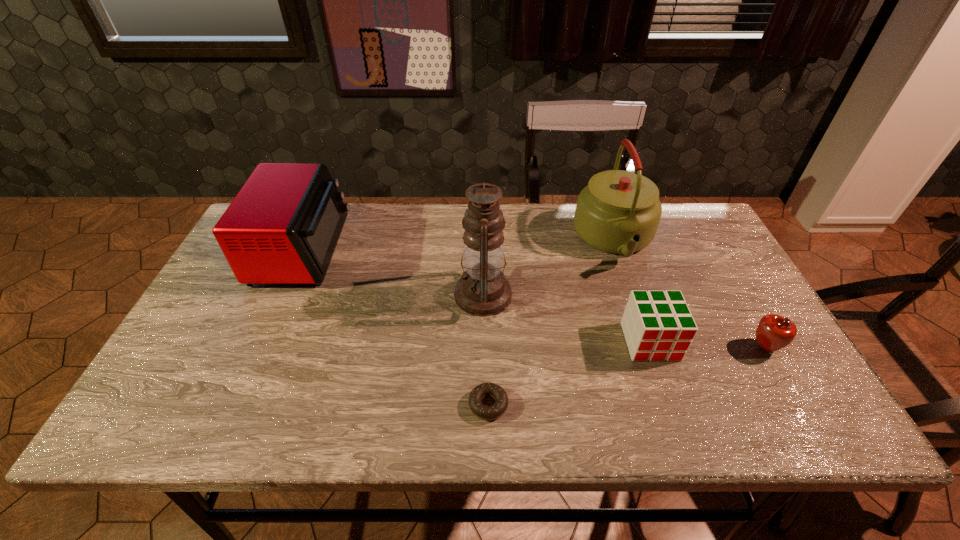
In order to click on free space located 0.270m at the spout of the fifth shortest object in this screenshot , I will do `click(655, 355)`.

What are the coordinates of `vacant area situated on the front-facing side of the leftmost object` in the screenshot? It's located at (454, 251).

This screenshot has width=960, height=540. In order to click on vacant space located on the red face of the fourth tallest object in this screenshot , I will do `click(681, 430)`.

Identify the location of vacant area situated on the left of the rightmost object. (680, 347).

Identify the location of free location located 0.270m on the left of the doughnut. (344, 405).

Where is `kettle that is at the far edge`? The image size is (960, 540). kettle that is at the far edge is located at coordinates (619, 211).

Where is `toaster oven that is positioned at the far edge`? This screenshot has height=540, width=960. toaster oven that is positioned at the far edge is located at coordinates (283, 226).

What are the coordinates of `object located at the near edge` in the screenshot? It's located at (484, 412).

The height and width of the screenshot is (540, 960). Find the location of `object positioned at the left edge`. object positioned at the left edge is located at coordinates (283, 226).

What are the coordinates of `object that is positioned at the right edge` in the screenshot? It's located at (773, 332).